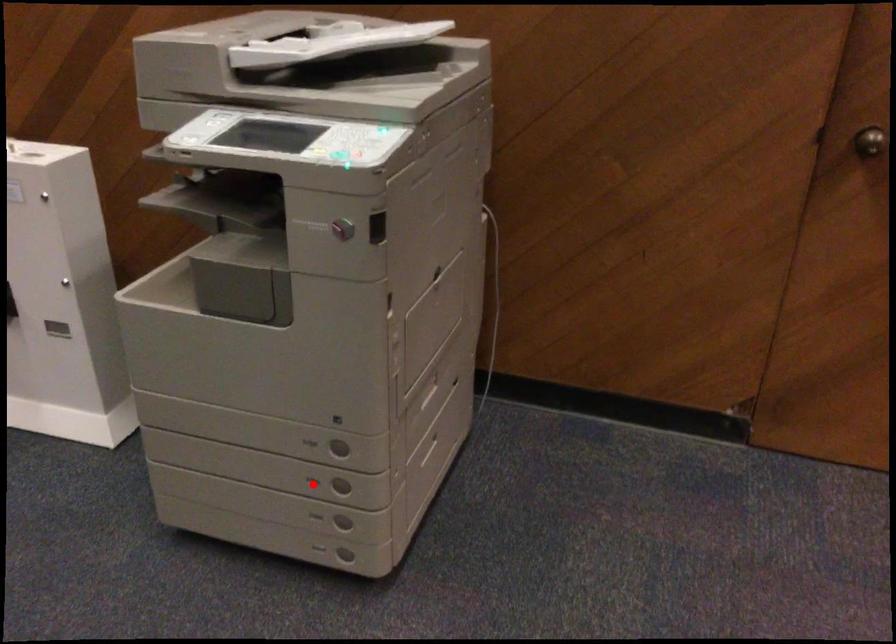
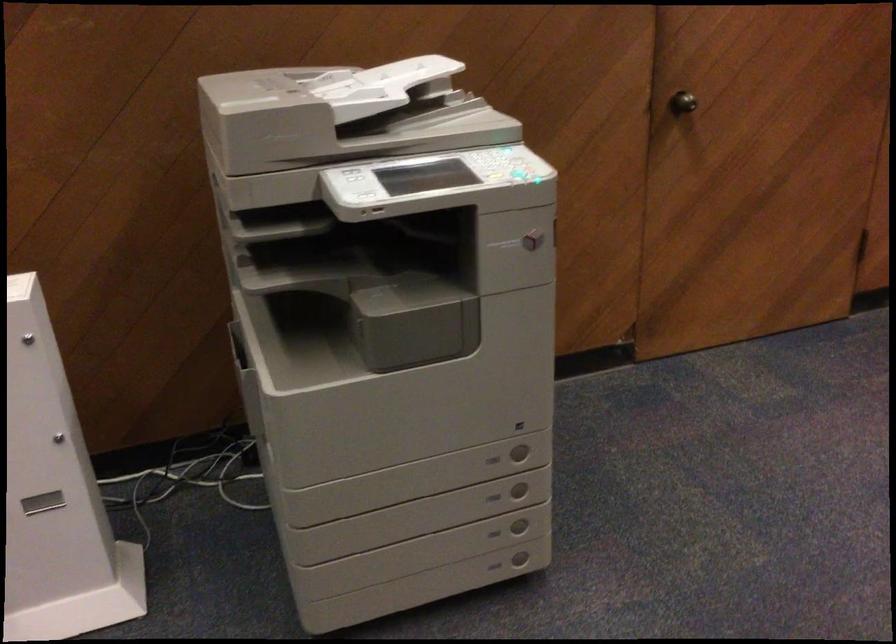
Where in the second image is the point corresponding to the highlighted location from the first image?

(493, 497)